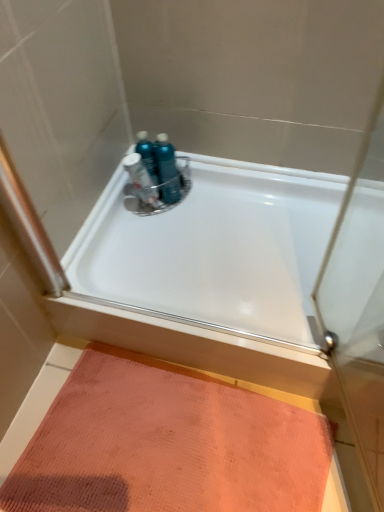
Question: Could teal plastic bottles at center, the third toiletry viewed from the left, be considered to be inside translucent plastic bottles at center, positioned as the third toiletry in right-to-left order?

Choices:
 (A) no
 (B) yes

Answer: (A)

Question: Is translucent plastic bottles at center, positioned as the third toiletry in right-to-left order, in contact with teal plastic bottles at center, positioned as the first toiletry in right-to-left order?

Choices:
 (A) yes
 (B) no

Answer: (A)

Question: Is translucent plastic bottles at center, which is the first toiletry from left to right, bigger than teal plastic bottles at center, positioned as the first toiletry in right-to-left order?

Choices:
 (A) yes
 (B) no

Answer: (B)

Question: Is translucent plastic bottles at center, positioned as the third toiletry in right-to-left order, shorter than teal plastic bottles at center, positioned as the first toiletry in right-to-left order?

Choices:
 (A) yes
 (B) no

Answer: (B)

Question: Is the depth of translucent plastic bottles at center, positioned as the third toiletry in right-to-left order, greater than that of teal plastic bottles at center, positioned as the first toiletry in right-to-left order?

Choices:
 (A) no
 (B) yes

Answer: (A)

Question: Considering the relative sizes of translucent plastic bottles at center, which is the first toiletry from left to right, and teal plastic bottles at center, positioned as the first toiletry in right-to-left order, in the image provided, is translucent plastic bottles at center, which is the first toiletry from left to right, thinner than teal plastic bottles at center, positioned as the first toiletry in right-to-left order,?

Choices:
 (A) no
 (B) yes

Answer: (B)

Question: Is teal plastic bottles at center, positioned as the first toiletry in right-to-left order, closer to camera compared to orange textured mat at lower left?

Choices:
 (A) no
 (B) yes

Answer: (A)

Question: Can we say teal plastic bottles at center, the third toiletry viewed from the left, lies outside orange textured mat at lower left?

Choices:
 (A) yes
 (B) no

Answer: (A)

Question: Is teal plastic bottles at center, positioned as the first toiletry in right-to-left order, wider than orange textured mat at lower left?

Choices:
 (A) yes
 (B) no

Answer: (B)

Question: Considering the relative sizes of teal plastic bottles at center, the third toiletry viewed from the left, and orange textured mat at lower left in the image provided, is teal plastic bottles at center, the third toiletry viewed from the left, bigger than orange textured mat at lower left?

Choices:
 (A) yes
 (B) no

Answer: (B)

Question: From a real-world perspective, is teal plastic bottles at center, the third toiletry viewed from the left, located higher than orange textured mat at lower left?

Choices:
 (A) yes
 (B) no

Answer: (A)

Question: From a real-world perspective, is teal plastic bottles at center, the third toiletry viewed from the left, located beneath orange textured mat at lower left?

Choices:
 (A) yes
 (B) no

Answer: (B)

Question: From a real-world perspective, is orange textured mat at lower left located higher than translucent plastic bottles at center, which is the first toiletry from left to right?

Choices:
 (A) yes
 (B) no

Answer: (B)